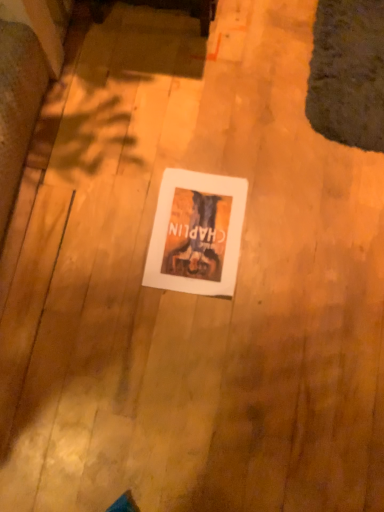
Locate an element on the screen. vacant area on top of white paper poster at center (from a real-world perspective) is located at coordinates (197, 237).